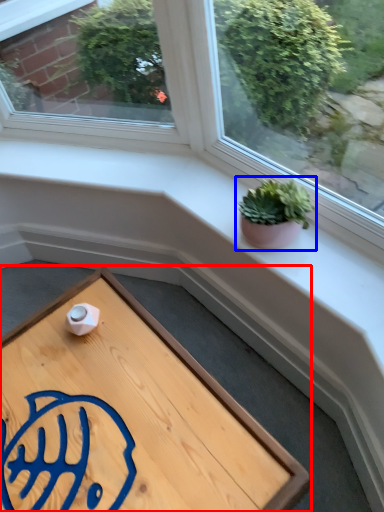
Question: Which object appears farthest to the camera in this image, table (highlighted by a red box) or houseplant (highlighted by a blue box)?

Choices:
 (A) table
 (B) houseplant

Answer: (B)